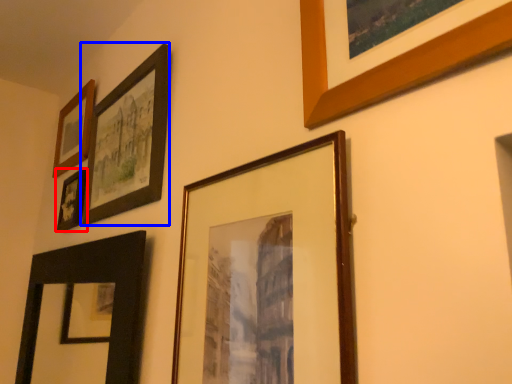
Question: Which point is further to the camera, picture frame (highlighted by a red box) or picture frame (highlighted by a blue box)?

Choices:
 (A) picture frame
 (B) picture frame

Answer: (A)